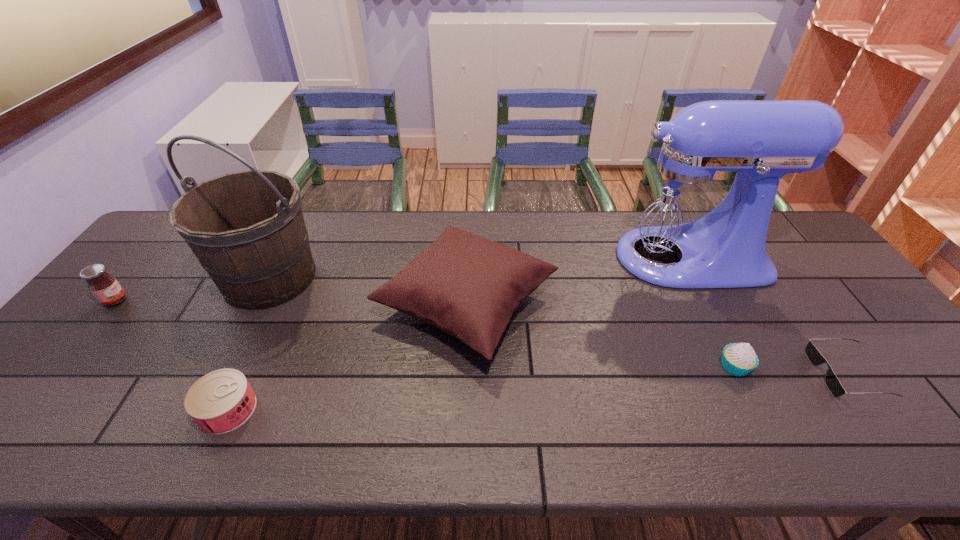
This screenshot has width=960, height=540. I want to click on mixer that is at the far edge, so click(x=686, y=222).

You are a GUI agent. You are given a task and a screenshot of the screen. Output one action in this format:
    pyautogui.click(x=<x>, y=<y>)
    Task: Click on the bucket that is at the far edge
    
    Given the screenshot: What is the action you would take?
    pyautogui.click(x=247, y=230)

You are a GUI agent. You are given a task and a screenshot of the screen. Output one action in this format:
    pyautogui.click(x=<x>, y=<y>)
    Task: Click on the cushion at the far edge
    
    Given the screenshot: What is the action you would take?
    pyautogui.click(x=468, y=286)

Locate an element on the screen. object situated at the near edge is located at coordinates (221, 401).

Identify the location of object located at the left edge. The height and width of the screenshot is (540, 960). (106, 289).

The width and height of the screenshot is (960, 540). What are the coordinates of `object at the right edge` in the screenshot? It's located at (832, 383).

Identify the location of free space at the far edge of the desktop. (433, 242).

Locate an element on the screen. The height and width of the screenshot is (540, 960). vacant space at the near edge of the desktop is located at coordinates (473, 433).

In the image, there is a desktop. Where is `vacant space at the left edge`? The width and height of the screenshot is (960, 540). vacant space at the left edge is located at coordinates (109, 336).

At what (x,y) coordinates should I click in order to perform the action: click on free region at the right edge of the desktop. Please return your answer as a coordinate pair (x, y). Looking at the image, I should click on (866, 392).